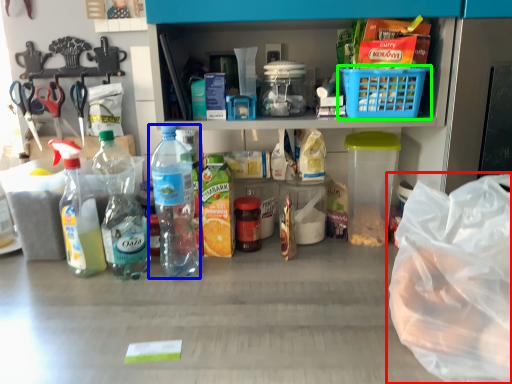
Question: Based on their relative distances, which object is farther from plastic bag (highlighted by a red box)? Choose from bottle (highlighted by a blue box) and basket (highlighted by a green box).

Choices:
 (A) bottle
 (B) basket

Answer: (A)